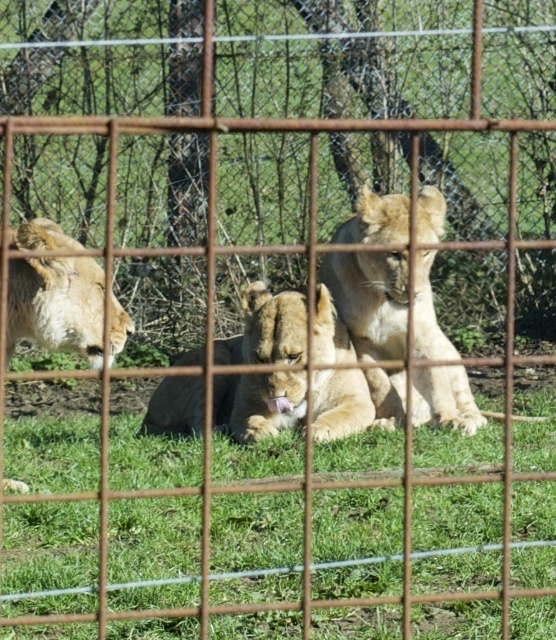
Question: Which of these objects is positioned closest to the golden fur lion at left?

Choices:
 (A) green grass at center
 (B) light brown fur lion at center

Answer: (A)

Question: Is light brown fur lion at center to the right of golden fur lion at center from the viewer's perspective?

Choices:
 (A) no
 (B) yes

Answer: (B)

Question: Which of the following is the closest to the observer?

Choices:
 (A) (96, 310)
 (B) (320, 285)
 (C) (384, 314)
 (D) (122, 456)

Answer: (A)

Question: Can you confirm if light brown fur lion at center is positioned to the left of golden fur lion at left?

Choices:
 (A) yes
 (B) no

Answer: (B)

Question: Which of these objects is positioned closest to the light brown fur lion at center?

Choices:
 (A) golden fur lion at center
 (B) golden fur lion at left
 (C) green grass at center

Answer: (A)

Question: Is light brown fur lion at center thinner than golden fur lion at center?

Choices:
 (A) no
 (B) yes

Answer: (B)